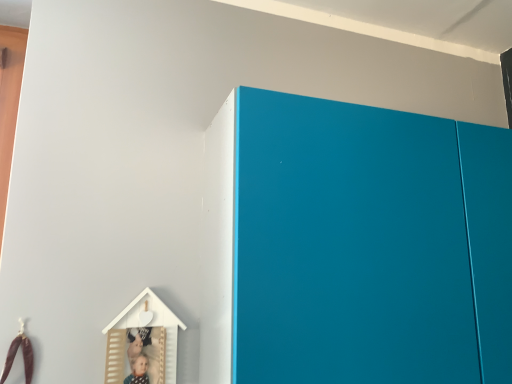
Question: Can you confirm if matte blue cabinet at upper right is smaller than brown leather toy at lower left, the 1th toy when ordered from left to right?

Choices:
 (A) no
 (B) yes

Answer: (A)

Question: Does matte blue cabinet at upper right turn towards brown leather toy at lower left, the 1th toy when ordered from left to right?

Choices:
 (A) no
 (B) yes

Answer: (A)

Question: Would you say matte blue cabinet at upper right contains brown leather toy at lower left, the 1th toy when ordered from left to right?

Choices:
 (A) yes
 (B) no

Answer: (B)

Question: Is matte blue cabinet at upper right positioned in front of brown leather toy at lower left, the 2th toy from the right?

Choices:
 (A) yes
 (B) no

Answer: (A)

Question: Is matte blue cabinet at upper right positioned far away from brown leather toy at lower left, the 1th toy when ordered from left to right?

Choices:
 (A) yes
 (B) no

Answer: (B)

Question: Considering the relative sizes of matte blue cabinet at upper right and brown leather toy at lower left, the 1th toy when ordered from left to right, in the image provided, is matte blue cabinet at upper right taller than brown leather toy at lower left, the 1th toy when ordered from left to right,?

Choices:
 (A) yes
 (B) no

Answer: (A)

Question: Is white matte wooden house at lower left, which is the 1th toy from right to left, positioned far away from brown leather toy at lower left, the 1th toy when ordered from left to right?

Choices:
 (A) no
 (B) yes

Answer: (A)

Question: Is white matte wooden house at lower left, which is the 1th toy from right to left, smaller than brown leather toy at lower left, the 2th toy from the right?

Choices:
 (A) no
 (B) yes

Answer: (A)

Question: Does white matte wooden house at lower left, arranged as the second toy when viewed from the left, appear on the left side of brown leather toy at lower left, the 2th toy from the right?

Choices:
 (A) no
 (B) yes

Answer: (A)

Question: Is white matte wooden house at lower left, arranged as the second toy when viewed from the left, to the right of brown leather toy at lower left, the 2th toy from the right, from the viewer's perspective?

Choices:
 (A) yes
 (B) no

Answer: (A)

Question: From a real-world perspective, is white matte wooden house at lower left, arranged as the second toy when viewed from the left, located higher than brown leather toy at lower left, the 1th toy when ordered from left to right?

Choices:
 (A) yes
 (B) no

Answer: (A)

Question: Can you confirm if white matte wooden house at lower left, arranged as the second toy when viewed from the left, is shorter than brown leather toy at lower left, the 2th toy from the right?

Choices:
 (A) no
 (B) yes

Answer: (A)

Question: Is white matte wooden house at lower left, arranged as the second toy when viewed from the left, at the left side of matte blue cabinet at upper right?

Choices:
 (A) no
 (B) yes

Answer: (B)